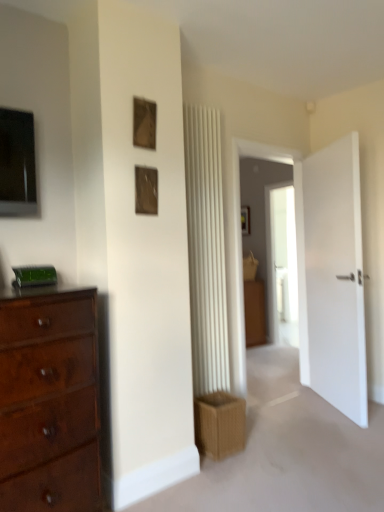
The height and width of the screenshot is (512, 384). I want to click on free space in front of brown cardboard crate at lower center, so click(227, 477).